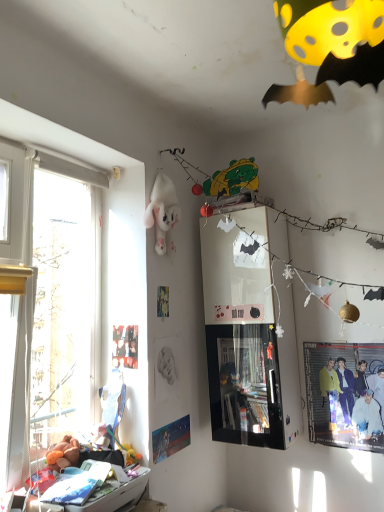
Question: Can we say matte black poster at upper left, the second poster page positioned from the right, lies outside matte yellow jacket at lower right?

Choices:
 (A) no
 (B) yes

Answer: (B)

Question: From a real-world perspective, is matte black poster at upper left, the 2th poster page positioned from the bottom, located higher than matte yellow jacket at lower right?

Choices:
 (A) no
 (B) yes

Answer: (B)

Question: Does matte black poster at upper left, the second poster page positioned from the right, have a greater width compared to matte yellow jacket at lower right?

Choices:
 (A) no
 (B) yes

Answer: (A)

Question: Does matte black poster at upper left, the first poster page from the left, have a greater height compared to matte yellow jacket at lower right?

Choices:
 (A) yes
 (B) no

Answer: (B)

Question: Can matte yellow jacket at lower right be found inside matte black poster at upper left, the 2th poster page positioned from the bottom?

Choices:
 (A) no
 (B) yes

Answer: (A)

Question: Based on their positions, is white plastic drawer at lower left located to the left or right of matte black poster at upper left, the first poster page from the left?

Choices:
 (A) left
 (B) right

Answer: (A)

Question: Considering the positions of white plastic drawer at lower left and matte black poster at upper left, which is counted as the first poster page, starting from the top, in the image, is white plastic drawer at lower left bigger or smaller than matte black poster at upper left, which is counted as the first poster page, starting from the top,?

Choices:
 (A) big
 (B) small

Answer: (A)

Question: Considering their positions, is white plastic drawer at lower left located in front of or behind matte black poster at upper left, the second poster page positioned from the right?

Choices:
 (A) front
 (B) behind

Answer: (A)

Question: Is point (130, 483) positioned closer to the camera than point (132, 366)?

Choices:
 (A) closer
 (B) farther

Answer: (A)

Question: Is point (380, 428) positioned closer to the camera than point (188, 437)?

Choices:
 (A) closer
 (B) farther

Answer: (A)

Question: In the image, is matte yellow jacket at lower right positioned in front of or behind matte blue poster at lower left, which is the first poster page in right-to-left order?

Choices:
 (A) front
 (B) behind

Answer: (B)

Question: From the image's perspective, is matte yellow jacket at lower right located above or below matte blue poster at lower left, the 1th poster page when ordered from bottom to top?

Choices:
 (A) below
 (B) above

Answer: (B)

Question: Would you say matte yellow jacket at lower right is inside or outside matte blue poster at lower left, the 1th poster page when ordered from bottom to top?

Choices:
 (A) inside
 (B) outside

Answer: (B)

Question: From their relative heights in the image, would you say fluffy orange teddy bear at lower left, the second toy viewed from the right, is taller or shorter than matte black poster at upper left, the second poster page positioned from the right?

Choices:
 (A) tall
 (B) short

Answer: (B)

Question: From a real-world perspective, is fluffy orange teddy bear at lower left, the 1th toy when ordered from front to back, above or below matte black poster at upper left, the 2th poster page positioned from the bottom?

Choices:
 (A) below
 (B) above

Answer: (A)